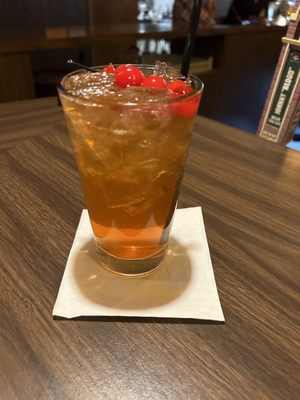
Where is `table`? The image size is (300, 400). table is located at coordinates (221, 163).